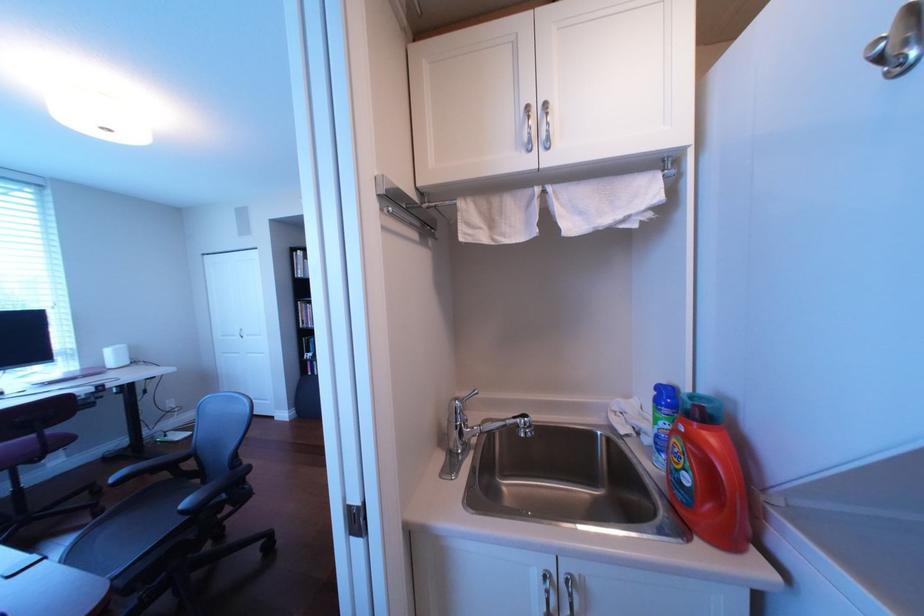
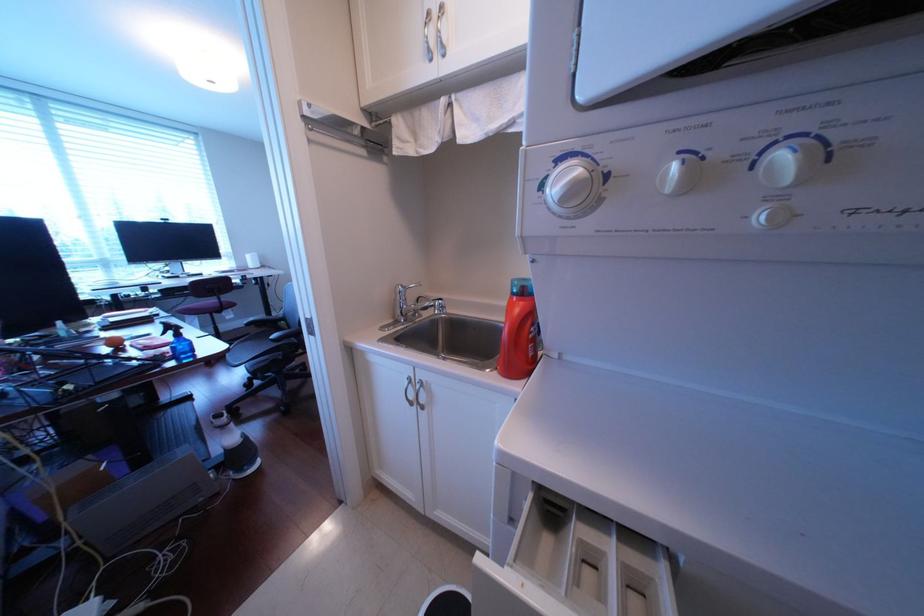
Question: The images are taken continuously from a first-person perspective. In which direction is your viewpoint rotating?

Choices:
 (A) Left
 (B) Right
 (C) Up
 (D) Down

Answer: (A)